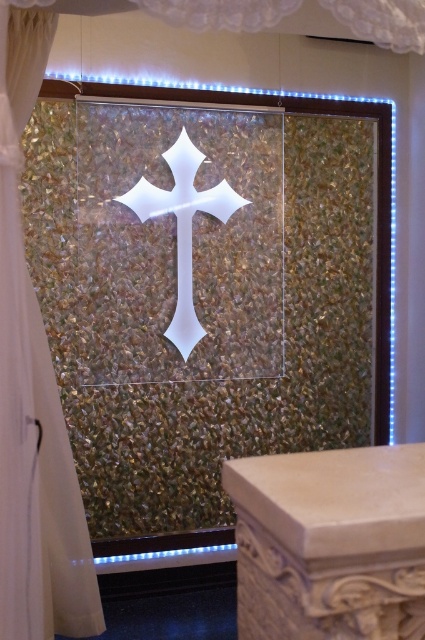
Question: Which object is positioned closest to the beige stone column at lower right?

Choices:
 (A) white sheer curtain at center
 (B) white glossy cross at center

Answer: (A)

Question: Which point appears closest to the camera in this image?

Choices:
 (A) (93, 634)
 (B) (286, 524)

Answer: (B)

Question: Is the position of beige stone column at lower right less distant than that of white glossy cross at center?

Choices:
 (A) yes
 (B) no

Answer: (A)

Question: Is beige stone column at lower right below white glossy cross at center?

Choices:
 (A) no
 (B) yes

Answer: (B)

Question: Does white sheer curtain at center appear on the left side of white glossy cross at center?

Choices:
 (A) no
 (B) yes

Answer: (B)

Question: Based on their relative distances, which object is nearer to the white sheer curtain at center?

Choices:
 (A) beige stone column at lower right
 (B) white glossy cross at center

Answer: (A)